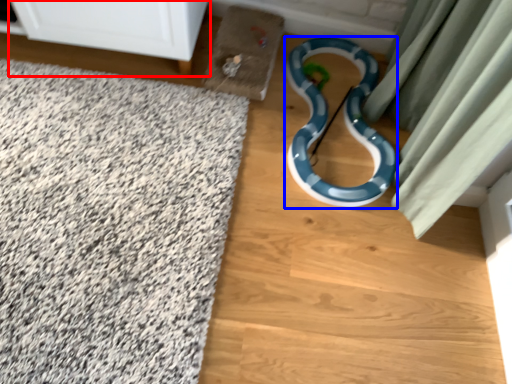
Question: Among these objects, which one is nearest to the camera, furniture (highlighted by a red box) or snake (highlighted by a blue box)?

Choices:
 (A) furniture
 (B) snake

Answer: (A)